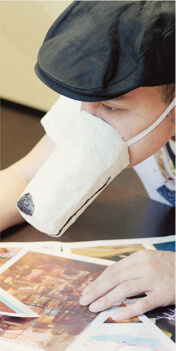
The image size is (176, 351). Find the location of `the bottom edge of picture`. the bottom edge of picture is located at coordinates (173, 349).